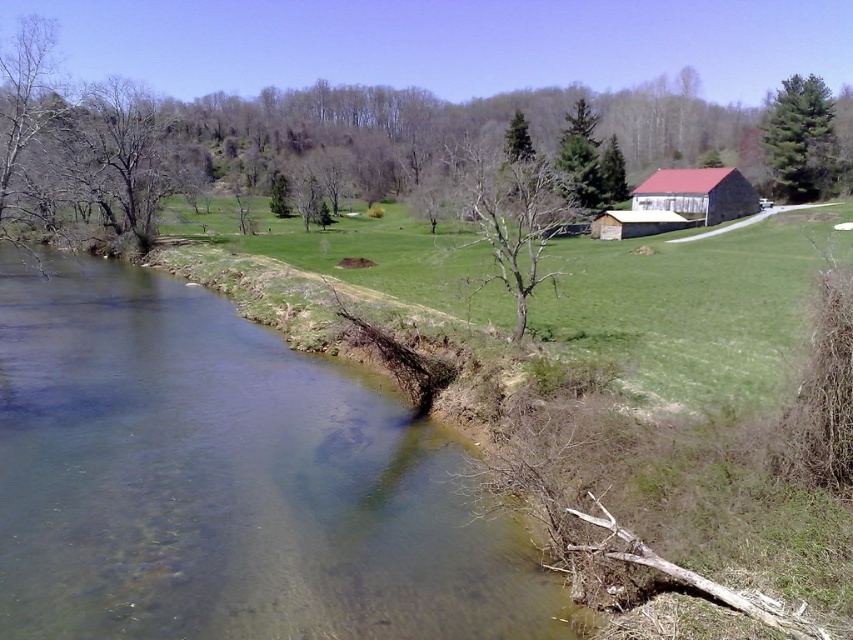
Who is positioned more to the right, bare wood tree at center or green textured pine tree at upper right?

green textured pine tree at upper right

Does bare wood tree at center have a larger size compared to green textured pine tree at upper right?

Yes, bare wood tree at center is bigger than green textured pine tree at upper right.

Between point (535, 252) and point (828, 116), which one is positioned behind?

The point (828, 116) is behind.

This screenshot has height=640, width=853. In order to click on bare wood tree at center in this screenshot , I will do `click(511, 214)`.

Is bare branches at left to the left of bare wood tree at center from the viewer's perspective?

Yes, bare branches at left is to the left of bare wood tree at center.

Which is behind, point (105, 152) or point (460, 170)?

Point (460, 170)

Image resolution: width=853 pixels, height=640 pixels. Describe the element at coordinates (120, 156) in the screenshot. I see `bare branches at left` at that location.

Identify the location of bare branches at left. (120, 156).

Is bare wood tree at center further to camera compared to red corrugated metal barn at right?

No, bare wood tree at center is in front of red corrugated metal barn at right.

How distant is bare wood tree at center from red corrugated metal barn at right?

bare wood tree at center and red corrugated metal barn at right are 17.41 meters apart.

Identify the location of bare wood tree at center. The width and height of the screenshot is (853, 640). (511, 214).